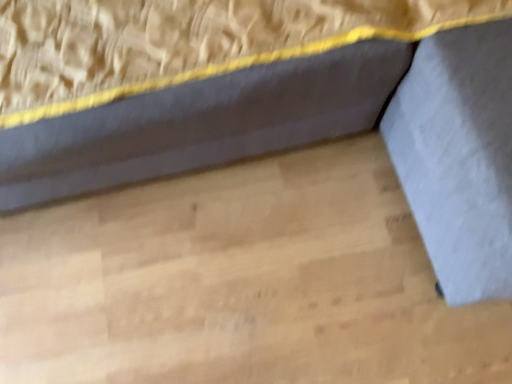
The height and width of the screenshot is (384, 512). Find the location of `matte gray cushion at lower right`. matte gray cushion at lower right is located at coordinates (201, 123).

This screenshot has height=384, width=512. What do you see at coordinates (201, 123) in the screenshot?
I see `matte gray cushion at lower right` at bounding box center [201, 123].

Where is `matte gray cushion at lower right`? matte gray cushion at lower right is located at coordinates (201, 123).